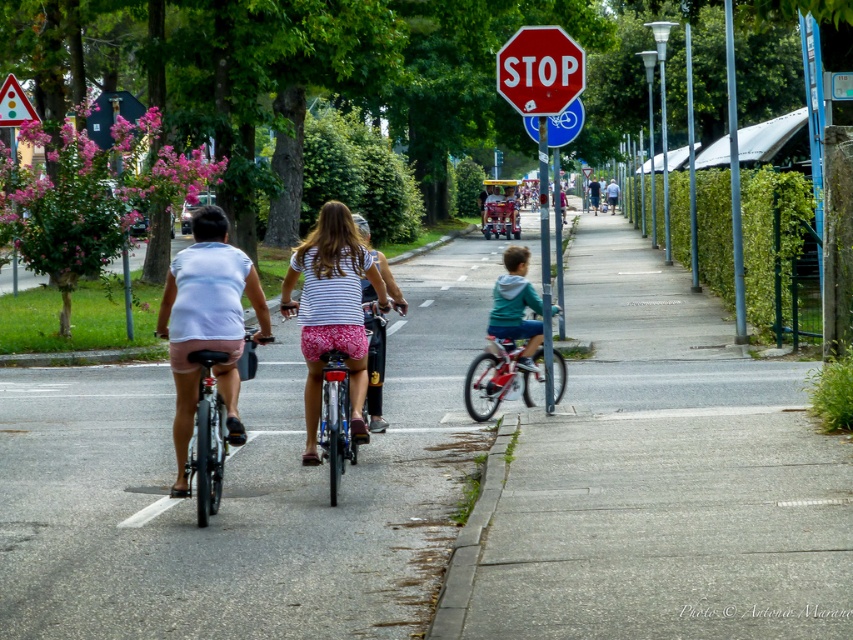
Question: From the image, what is the correct spatial relationship of smooth asphalt road at center in relation to striped fabric shirt at center?

Choices:
 (A) below
 (B) above

Answer: (A)

Question: Which of the following is the closest to the observer?

Choices:
 (A) blue metallic bicycle at upper center
 (B) white matte bicycle helmet at center

Answer: (B)

Question: From the image, what is the correct spatial relationship of striped fabric shirt at center in relation to blue metallic bicycle at upper center?

Choices:
 (A) above
 (B) below

Answer: (B)

Question: Is shiny red bicycle at center smaller than brushed metal triangle at upper left?

Choices:
 (A) no
 (B) yes

Answer: (B)

Question: Which point is farther to the camera?

Choices:
 (A) (566, 141)
 (B) (355, 285)
 (C) (367, 228)
 (D) (201, 240)

Answer: (A)

Question: Estimate the real-world distances between objects in this image. Which object is farther from the white matte shorts at left?

Choices:
 (A) shiny red bicycle at center
 (B) blue metallic bicycle at upper center
 (C) white matte bicycle helmet at center
 (D) striped fabric shirt at center

Answer: (B)